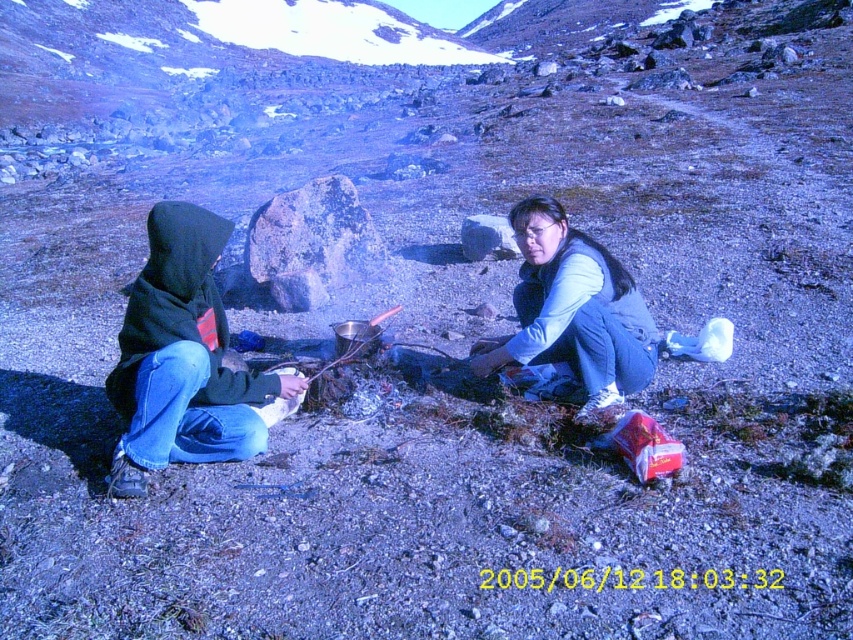
Question: Is black fleece jacket at left wider than blue denim jeans at lower right?

Choices:
 (A) yes
 (B) no

Answer: (B)

Question: Which object is positioned farthest from the blue denim jeans at lower right?

Choices:
 (A) black fleece jacket at left
 (B) black hooded jacket at left

Answer: (A)

Question: Which object is positioned farthest from the black fleece jacket at left?

Choices:
 (A) blue denim jeans at lower right
 (B) black hooded jacket at left

Answer: (A)

Question: Which point is farther from the camera taking this photo?

Choices:
 (A) (521, 211)
 (B) (190, 400)
 (C) (592, 291)

Answer: (A)

Question: Considering the relative positions of black fleece jacket at left and blue denim jeans at lower right in the image provided, where is black fleece jacket at left located with respect to blue denim jeans at lower right?

Choices:
 (A) right
 (B) left

Answer: (B)

Question: Observing the image, what is the correct spatial positioning of black hooded jacket at left in reference to blue denim jeans at lower right?

Choices:
 (A) above
 (B) below

Answer: (B)